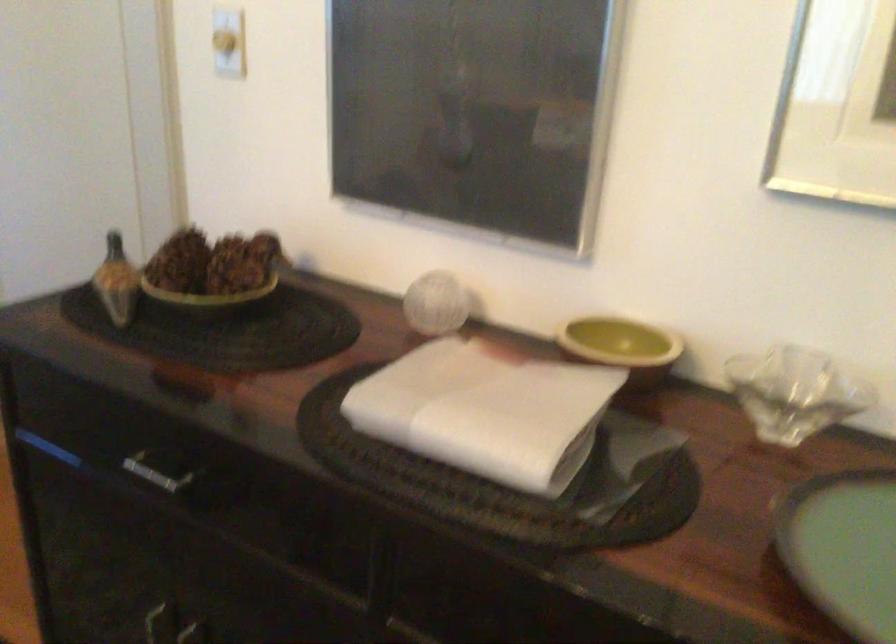
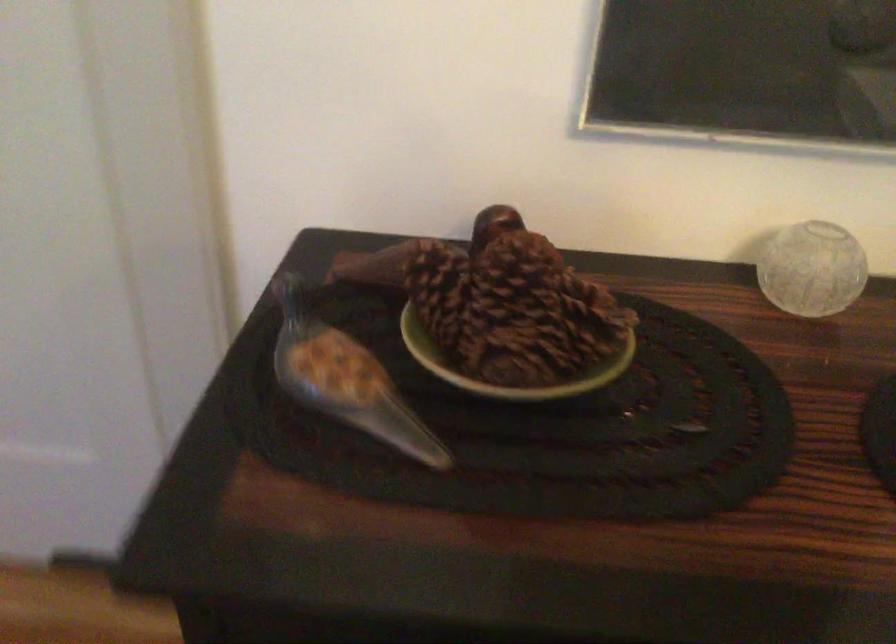
Where in the second image is the point corresponding to point (107, 299) from the first image?

(347, 386)